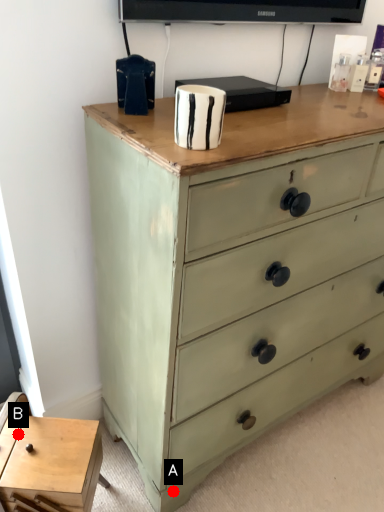
Question: Two points are circled on the image, labeled by A and B beside each circle. Among these points, which one is nearest to the camera?

Choices:
 (A) A is closer
 (B) B is closer

Answer: (B)